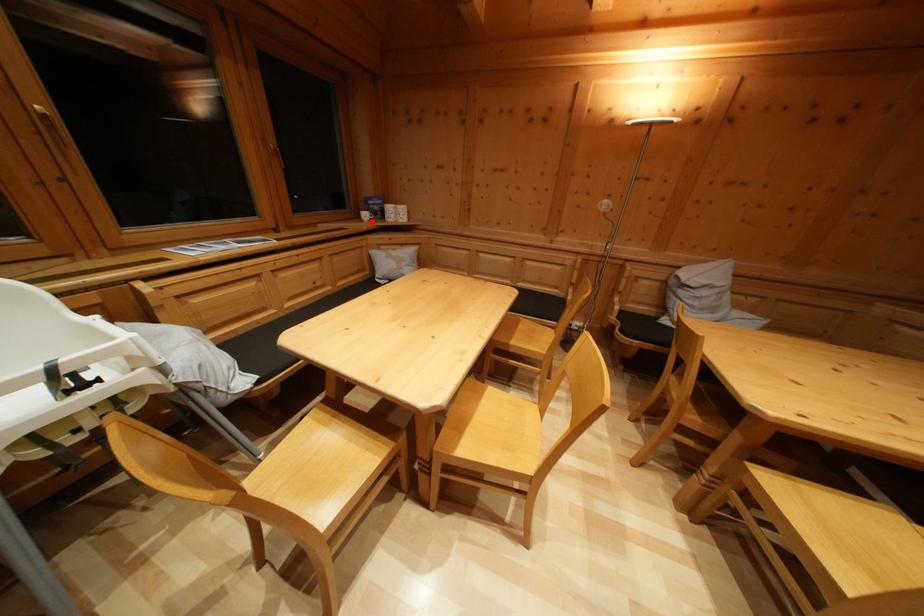
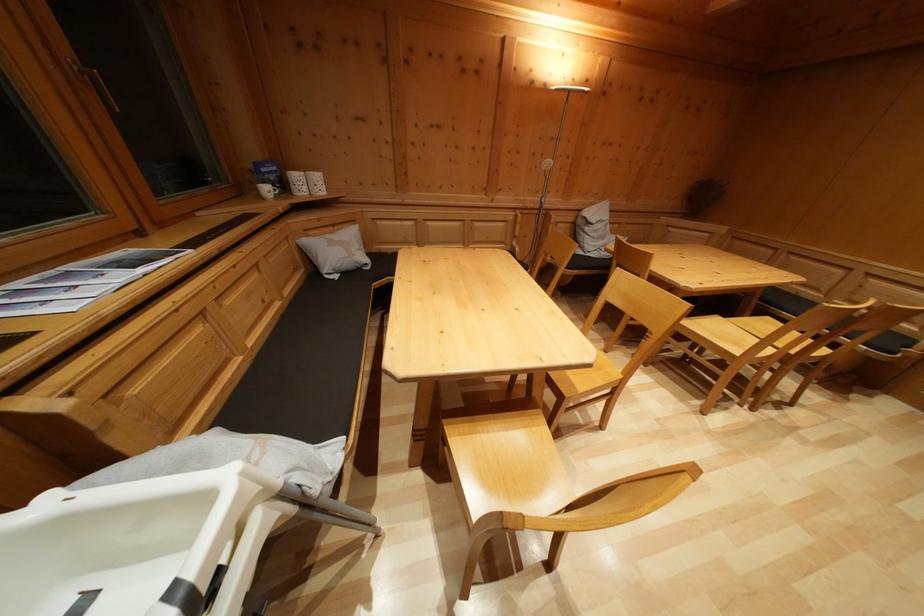
The point at the highlighted location is marked in the first image. Where is the corresponding point in the second image?

(273, 197)